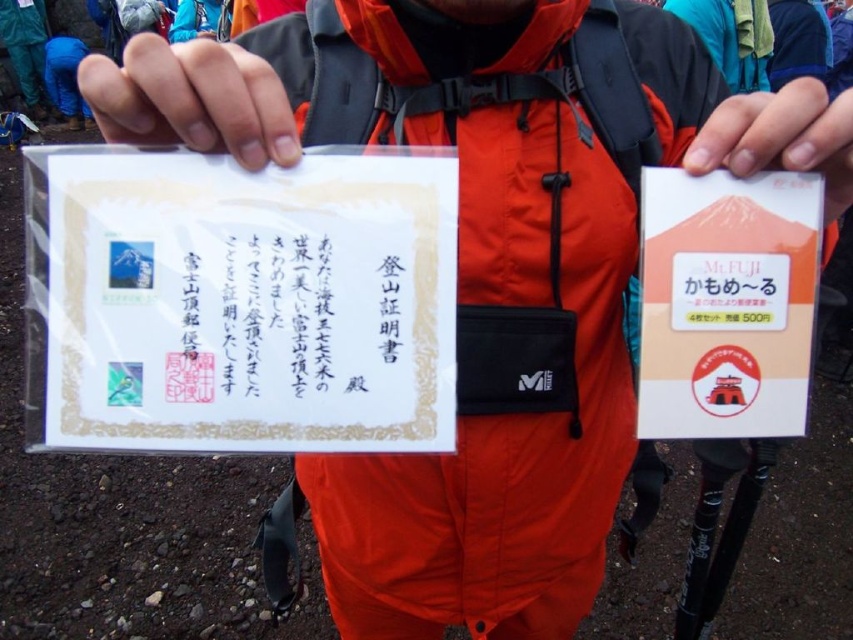
Image resolution: width=853 pixels, height=640 pixels. What do you see at coordinates (190, 99) in the screenshot? I see `matte white paper at upper center` at bounding box center [190, 99].

Does matte white paper at upper center have a greater width compared to matte plastic card at center?

Correct, the width of matte white paper at upper center exceeds that of matte plastic card at center.

Which is behind, point (293, 154) or point (749, 122)?

The point (749, 122) is behind.

Find the location of a particular element. This screenshot has width=853, height=640. matte white paper at upper center is located at coordinates (190, 99).

Describe the element at coordinates (289, 310) in the screenshot. I see `white paper at center` at that location.

From the picture: Between white paper at center and matte white paper at upper center, which one has more height?

matte white paper at upper center

Is point (300, 264) positioned after point (120, 72)?

Yes, point (300, 264) is behind point (120, 72).

Find the location of a particular element. The height and width of the screenshot is (640, 853). white paper at center is located at coordinates (289, 310).

Which is behind, point (241, 272) or point (769, 145)?

The point (241, 272) is behind.

From the picture: Is white paper at center taller than matte plastic card at center?

Incorrect, white paper at center's height is not larger of matte plastic card at center's.

At what (x,y) coordinates should I click in order to perform the action: click on white paper at center. Please return your answer as a coordinate pair (x, y). Looking at the image, I should click on (289, 310).

This screenshot has width=853, height=640. In order to click on white paper at center in this screenshot , I will do `click(289, 310)`.